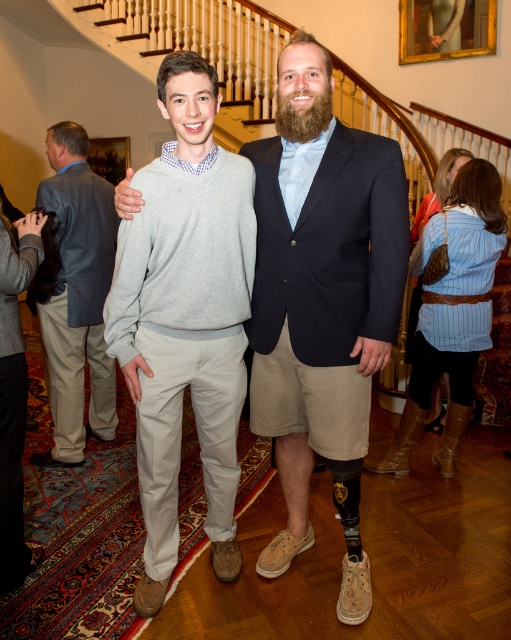
Question: Which point is closer to the camera taking this photo?

Choices:
 (A) (220, 154)
 (B) (264, 412)
 (C) (98, 177)

Answer: (A)

Question: Can you confirm if gray cotton sweater at center is positioned below gray sweater at center?

Choices:
 (A) no
 (B) yes

Answer: (B)

Question: Can you confirm if gray cotton sweater at center is smaller than gray sweater at center?

Choices:
 (A) yes
 (B) no

Answer: (A)

Question: Which object is closer to the camera taking this photo?

Choices:
 (A) gray sweater at center
 (B) gray cotton sweater at center

Answer: (B)

Question: Observing the image, what is the correct spatial positioning of gray cotton sweater at center in reference to gray sweater at center?

Choices:
 (A) right
 (B) left

Answer: (A)

Question: Among these points, which one is farthest from the camera?

Choices:
 (A) (369, 195)
 (B) (71, 397)
 (C) (188, 305)

Answer: (B)